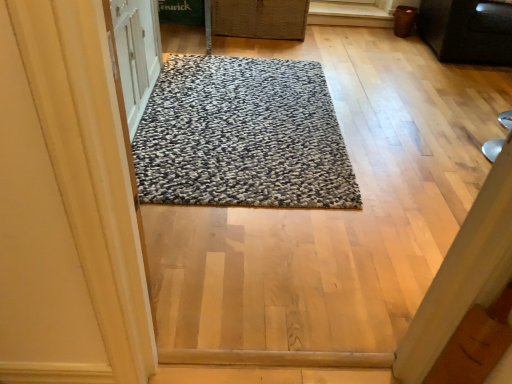
This screenshot has height=384, width=512. Identify the location of free region on the left part of black matte cabinet at upper right. (377, 56).